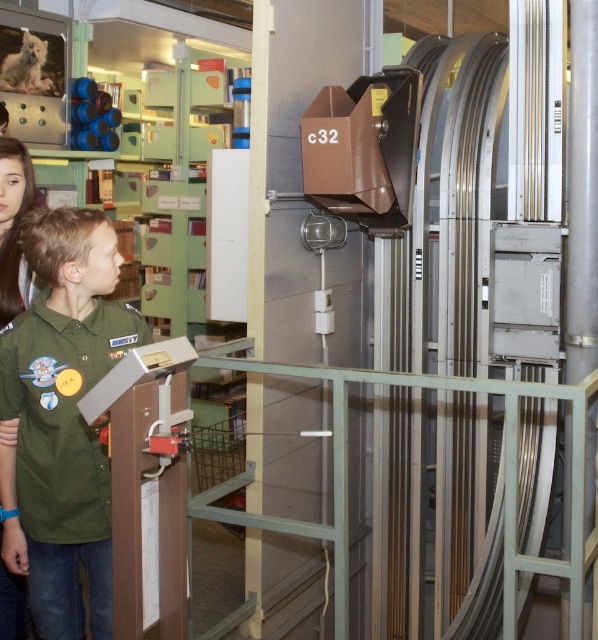
Question: Can you confirm if green matte shirt at left is positioned to the right of matte green shirt at left?

Choices:
 (A) no
 (B) yes

Answer: (B)

Question: Does green matte shirt at left have a larger size compared to matte green shirt at left?

Choices:
 (A) no
 (B) yes

Answer: (B)

Question: Does green matte shirt at left have a greater width compared to matte green shirt at left?

Choices:
 (A) yes
 (B) no

Answer: (A)

Question: Which of the following is the farthest from the observer?

Choices:
 (A) (13, 154)
 (B) (86, 340)

Answer: (A)